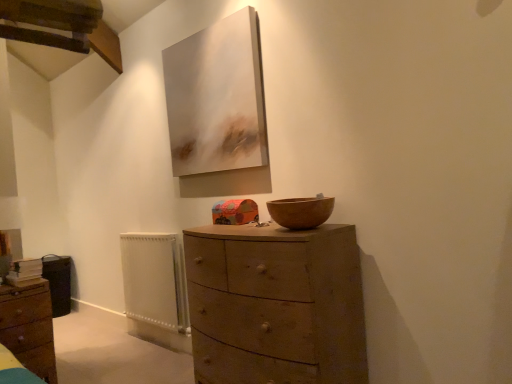
Question: Choose the correct answer: Is matte brown chest of drawers at lower left, which ranks as the 2th chest of drawers in right-to-left order, inside white painted metal radiator at lower left or outside it?

Choices:
 (A) inside
 (B) outside

Answer: (B)

Question: Is point (35, 321) positioned closer to the camera than point (176, 311)?

Choices:
 (A) farther
 (B) closer

Answer: (B)

Question: Which of these objects is positioned farthest from the wooden bowl at center?

Choices:
 (A) white painted metal radiator at lower left
 (B) matte white canvas at upper center
 (C) matte brown chest of drawers at lower left, which ranks as the 2th chest of drawers in right-to-left order
 (D) wooden chest of drawers at center, the first chest of drawers in the right-to-left sequence

Answer: (C)

Question: Estimate the real-world distances between objects in this image. Which object is closer to the white painted metal radiator at lower left?

Choices:
 (A) wooden chest of drawers at center, the first chest of drawers in the right-to-left sequence
 (B) matte brown chest of drawers at lower left, which ranks as the 2th chest of drawers in right-to-left order
 (C) matte white canvas at upper center
 (D) wooden bowl at center

Answer: (B)